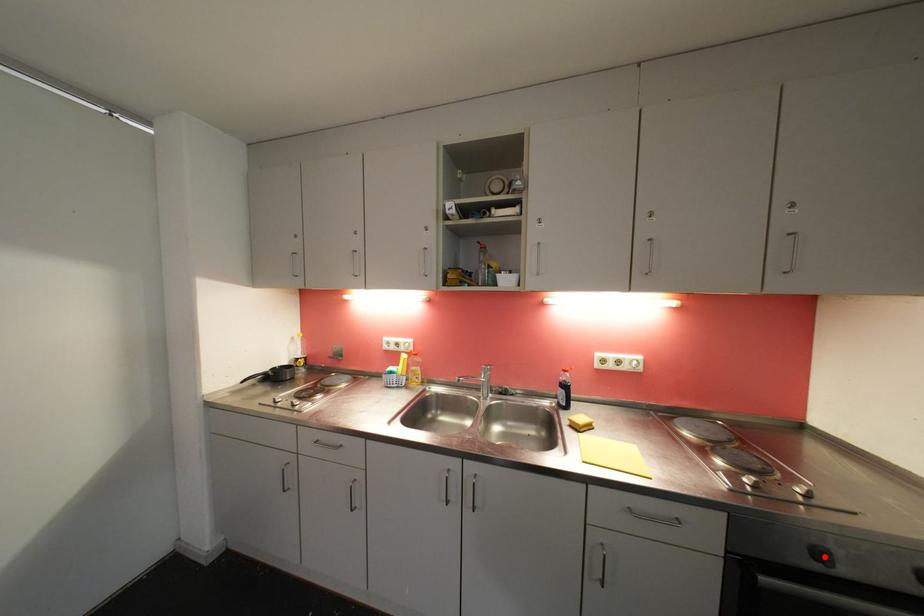
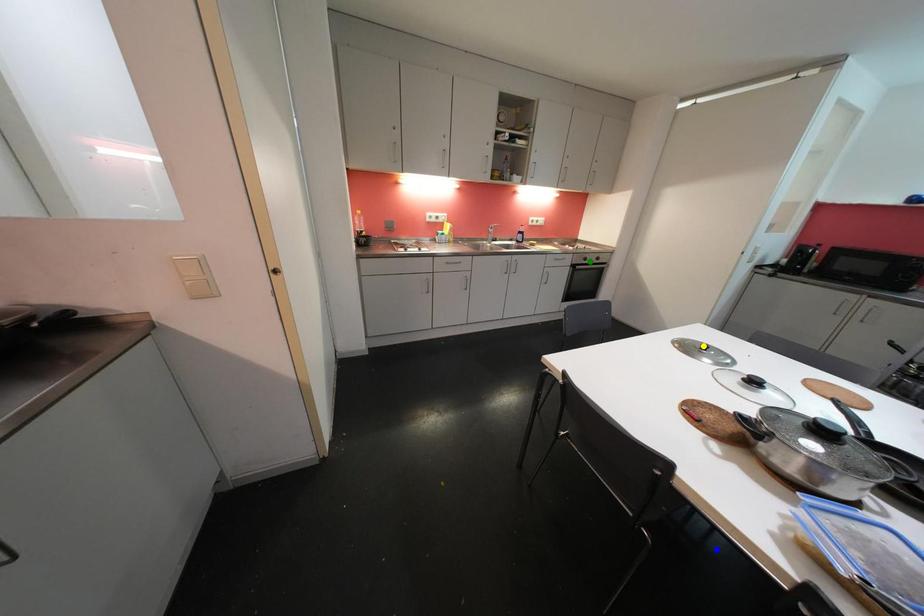
Question: I am providing you with two images of the same scene from different viewpoints. A red point is marked on the first image. You are given multiple points on the second image. Which point in image 2 represents the same 3d spot as the red point in image 1?

Choices:
 (A) blue point
 (B) yellow point
 (C) green point

Answer: (C)